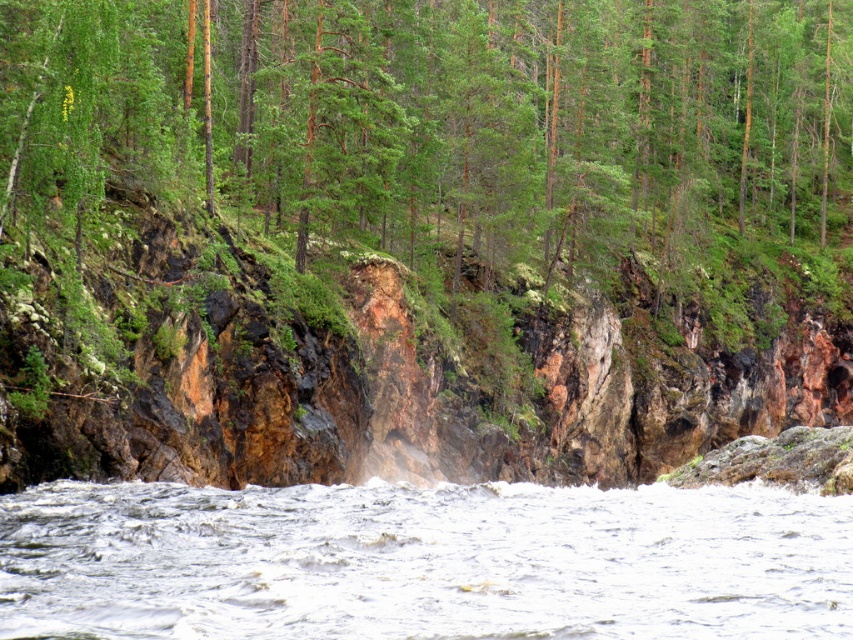
Looking at this image, you are a hiker planning to cross the white frothy water at center near the rusty rock cliff at center. Considering the size of the cliff compared to the water, which one would require more caution when navigating around it?

The rusty rock cliff at center is larger in size than the white frothy water at center, so you should exercise more caution around the rusty rock cliff at center due to its larger size and potential instability.

You are standing at the edge of the cliff and want to place a 1.2 meter wide picnic blanket between the green matte rock at center and the white frothy water at center. Can the space between them accommodate the blanket?

The green matte rock at center might be wider than white frothy water at center, so the space between them may or may not be wide enough for the 1.2 meter picnic blanket. It is uncertain without exact measurements.